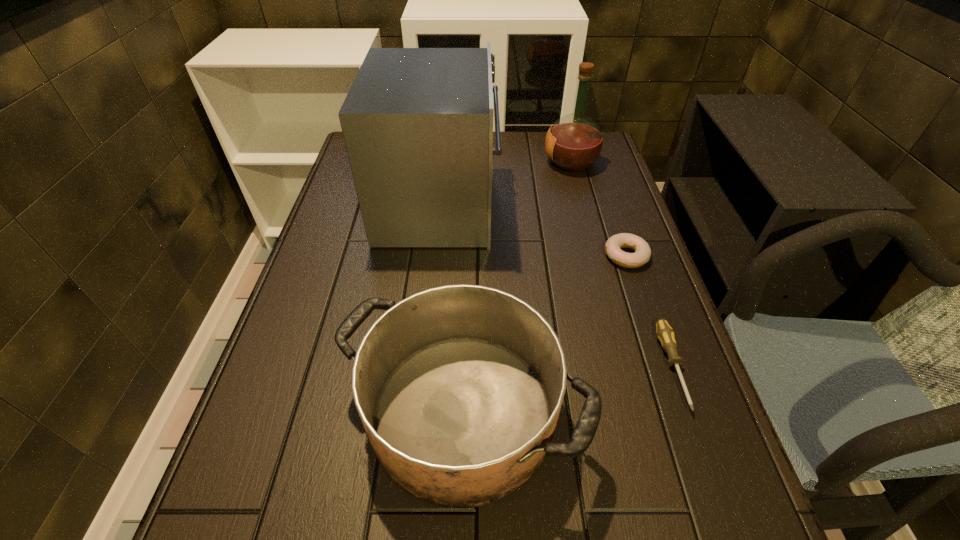
You are a GUI agent. You are given a task and a screenshot of the screen. Output one action in this format:
    pyautogui.click(x=<x>, y=<y>)
    Task: Click on the free location located on the back of the doughnut
    This screenshot has height=540, width=960.
    Given the screenshot: What is the action you would take?
    pyautogui.click(x=600, y=178)

The image size is (960, 540). I want to click on vacant space situated at the tip of the screwdriver, so (x=713, y=484).

What are the coordinates of `toaster oven located in the far edge section of the desktop` in the screenshot? It's located at (417, 123).

Find the location of a particular element. The width and height of the screenshot is (960, 540). liquor present at the far edge is located at coordinates (574, 142).

This screenshot has width=960, height=540. In order to click on object present at the left edge in this screenshot , I will do `click(417, 123)`.

This screenshot has width=960, height=540. Identify the location of liquor that is at the right edge. (574, 142).

The height and width of the screenshot is (540, 960). I want to click on doughnut that is at the right edge, so click(642, 250).

Locate an element on the screen. screwdriver present at the right edge is located at coordinates (665, 334).

Where is `object positioned at the far left corner`? The height and width of the screenshot is (540, 960). object positioned at the far left corner is located at coordinates (417, 123).

Where is `object located in the far right corner section of the desktop`? This screenshot has width=960, height=540. object located in the far right corner section of the desktop is located at coordinates (574, 142).